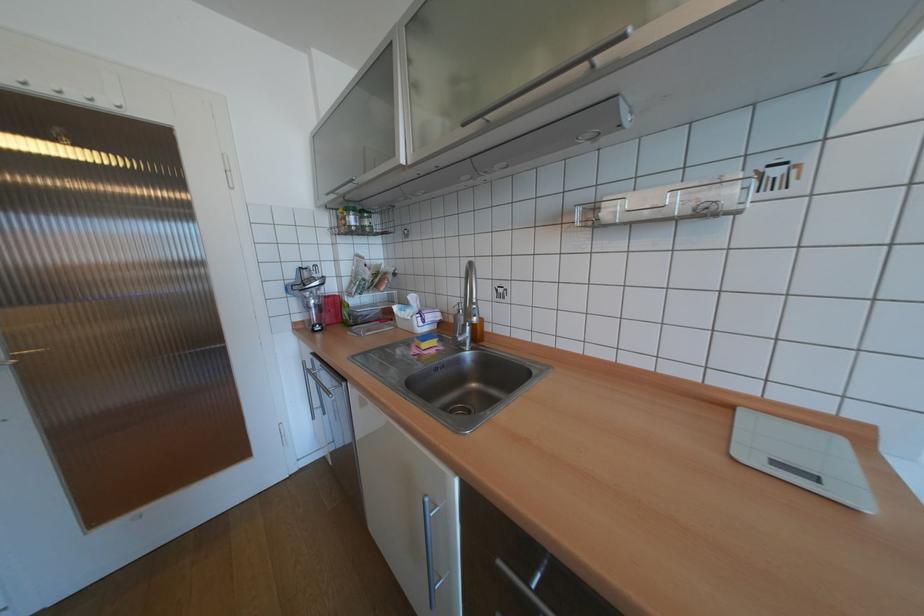
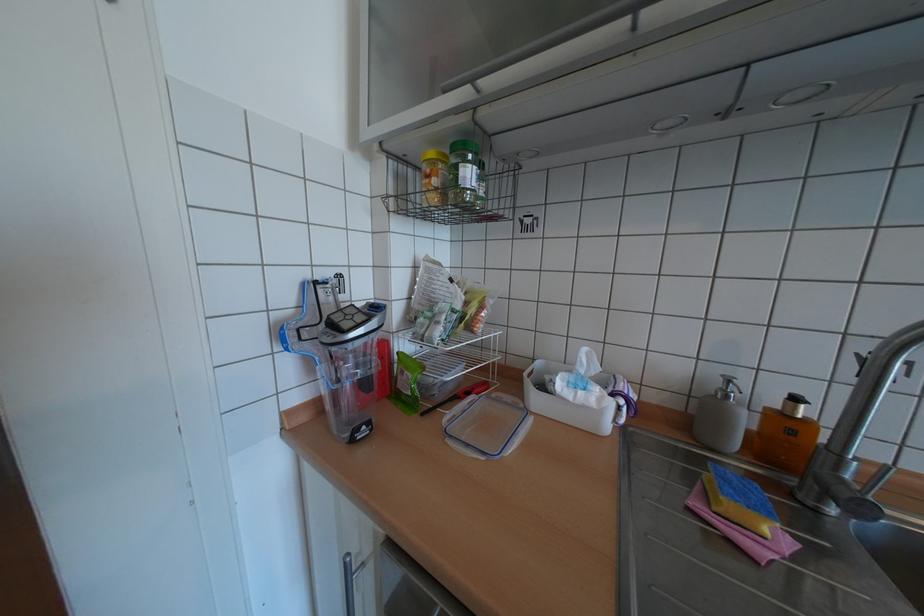
The images are taken continuously from a first-person perspective. In which direction are you moving?

The cameraman walked toward left, forward.